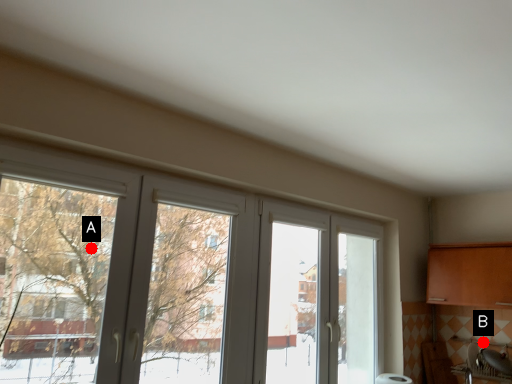
Question: Two points are circled on the image, labeled by A and B beside each circle. Which point is further to the camera?

Choices:
 (A) A is further
 (B) B is further

Answer: (B)